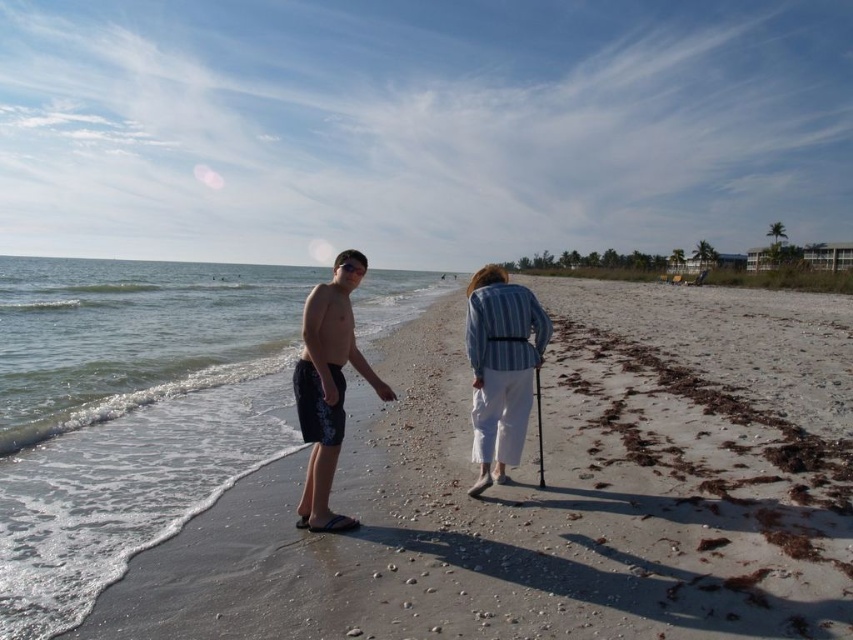
Who is positioned more to the left, light beige sand at lower left or clear water at shore left?

From the viewer's perspective, clear water at shore left appears more on the left side.

Who is shorter, light beige sand at lower left or clear water at shore left?

light beige sand at lower left is shorter.

Between point (653, 410) and point (283, 280), which one is positioned behind?

Point (283, 280)

At what (x,y) coordinates should I click in order to perform the action: click on light beige sand at lower left. Please return your answer as a coordinate pair (x, y). The height and width of the screenshot is (640, 853). Looking at the image, I should click on (552, 492).

Between point (32, 576) and point (343, 352), which one is positioned behind?

The point (343, 352) is behind.

Is clear water at shore left positioned in front of dark blue swim trunks at left?

Yes, clear water at shore left is in front of dark blue swim trunks at left.

Is point (218, 493) in front of point (345, 336)?

No, (218, 493) is behind (345, 336).

Locate an element on the screen. The width and height of the screenshot is (853, 640). clear water at shore left is located at coordinates (129, 412).

The height and width of the screenshot is (640, 853). Identify the location of clear water at shore left. (129, 412).

Can you confirm if clear water at shore left is positioned below striped fabric cane at center?

No.

The width and height of the screenshot is (853, 640). Describe the element at coordinates (129, 412) in the screenshot. I see `clear water at shore left` at that location.

You are a GUI agent. You are given a task and a screenshot of the screen. Output one action in this format:
    pyautogui.click(x=<x>, y=<y>)
    Task: Click on the clear water at shore left
    The height and width of the screenshot is (640, 853).
    Given the screenshot: What is the action you would take?
    pyautogui.click(x=129, y=412)